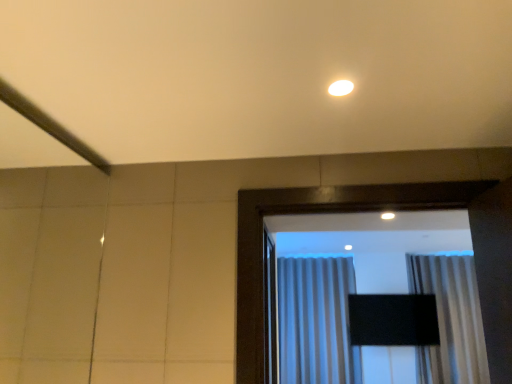
The height and width of the screenshot is (384, 512). What do you see at coordinates (450, 320) in the screenshot?
I see `silky white curtain at center, which is the 2th curtain in left-to-right order` at bounding box center [450, 320].

The image size is (512, 384). I want to click on silky white curtain at center, the 1th curtain from the right, so click(x=450, y=320).

Identify the location of silky white curtain at center, the 1th curtain from the right. This screenshot has height=384, width=512. (450, 320).

Who is bigger, gray textured curtain at center, placed as the second curtain when sorted from right to left, or silky white curtain at center, the 1th curtain from the right?

gray textured curtain at center, placed as the second curtain when sorted from right to left.

Is gray textured curtain at center, placed as the second curtain when sorted from right to left, facing away from silky white curtain at center, the 1th curtain from the right?

No, gray textured curtain at center, placed as the second curtain when sorted from right to left, is not facing the opposite direction of silky white curtain at center, the 1th curtain from the right.

Is gray textured curtain at center, placed as the second curtain when sorted from right to left, situated inside silky white curtain at center, the 1th curtain from the right, or outside?

gray textured curtain at center, placed as the second curtain when sorted from right to left, is located beyond the bounds of silky white curtain at center, the 1th curtain from the right.

Can you confirm if gray textured curtain at center, placed as the second curtain when sorted from right to left, is shorter than silky white curtain at center, which is the 2th curtain in left-to-right order?

Incorrect, the height of gray textured curtain at center, placed as the second curtain when sorted from right to left, does not fall short of that of silky white curtain at center, which is the 2th curtain in left-to-right order.

Where is `curtain in front of the gray textured curtain at center, placed as the second curtain when sorted from right to left`? curtain in front of the gray textured curtain at center, placed as the second curtain when sorted from right to left is located at coordinates (450, 320).

Could you tell me if silky white curtain at center, the 1th curtain from the right, is facing gray textured curtain at center, the first curtain from the left?

No, silky white curtain at center, the 1th curtain from the right, does not turn towards gray textured curtain at center, the first curtain from the left.

From the picture: From a real-world perspective, does silky white curtain at center, which is the 2th curtain in left-to-right order, sit lower than gray textured curtain at center, placed as the second curtain when sorted from right to left?

No, from a real-world perspective, silky white curtain at center, which is the 2th curtain in left-to-right order, is not beneath gray textured curtain at center, placed as the second curtain when sorted from right to left.

Which of these two, silky white curtain at center, the 1th curtain from the right, or gray textured curtain at center, placed as the second curtain when sorted from right to left, is smaller?

With smaller size is silky white curtain at center, the 1th curtain from the right.

Is point (344, 82) in front of point (473, 342)?

Yes, it is in front of point (473, 342).

Which object is more forward, white glossy light fixture at upper center or silky white curtain at center, the 1th curtain from the right?

white glossy light fixture at upper center is more forward.

Does white glossy light fixture at upper center turn towards silky white curtain at center, the 1th curtain from the right?

No, white glossy light fixture at upper center is not turned towards silky white curtain at center, the 1th curtain from the right.

Considering the sizes of objects white glossy light fixture at upper center and silky white curtain at center, the 1th curtain from the right, in the image provided, who is taller, white glossy light fixture at upper center or silky white curtain at center, the 1th curtain from the right,?

Standing taller between the two is silky white curtain at center, the 1th curtain from the right.

Is white glossy light fixture at upper center not close to gray textured curtain at center, the first curtain from the left?

Yes.

Is white glossy light fixture at upper center at the left side of gray textured curtain at center, the first curtain from the left?

Indeed, white glossy light fixture at upper center is positioned on the left side of gray textured curtain at center, the first curtain from the left.

Which object is closer to the camera, white glossy light fixture at upper center or gray textured curtain at center, placed as the second curtain when sorted from right to left?

white glossy light fixture at upper center is in front.

Between white glossy light fixture at upper center and gray textured curtain at center, placed as the second curtain when sorted from right to left, which one has smaller size?

white glossy light fixture at upper center.

Between silky white curtain at center, which is the 2th curtain in left-to-right order, and white glossy light fixture at upper center, which one has smaller size?

Smaller between the two is white glossy light fixture at upper center.

Looking at their sizes, would you say silky white curtain at center, which is the 2th curtain in left-to-right order, is wider or thinner than white glossy light fixture at upper center?

Considering their sizes, silky white curtain at center, which is the 2th curtain in left-to-right order, looks broader than white glossy light fixture at upper center.

Between silky white curtain at center, which is the 2th curtain in left-to-right order, and white glossy light fixture at upper center, which one is positioned in front?

white glossy light fixture at upper center is in front.

In terms of width, does gray textured curtain at center, placed as the second curtain when sorted from right to left, look wider or thinner when compared to white glossy light fixture at upper center?

gray textured curtain at center, placed as the second curtain when sorted from right to left, is wider than white glossy light fixture at upper center.

Is gray textured curtain at center, the first curtain from the left, in front of or behind white glossy light fixture at upper center in the image?

In the image, gray textured curtain at center, the first curtain from the left, appears behind white glossy light fixture at upper center.

Considering the sizes of objects gray textured curtain at center, placed as the second curtain when sorted from right to left, and white glossy light fixture at upper center in the image provided, who is shorter, gray textured curtain at center, placed as the second curtain when sorted from right to left, or white glossy light fixture at upper center?

With less height is white glossy light fixture at upper center.

At what (x,y) coordinates should I click in order to perform the action: click on curtain that appears below the silky white curtain at center, the 1th curtain from the right (from the image's perspective). Please return your answer as a coordinate pair (x, y). The height and width of the screenshot is (384, 512). Looking at the image, I should click on (316, 321).

The width and height of the screenshot is (512, 384). I want to click on curtain located on the left of silky white curtain at center, which is the 2th curtain in left-to-right order, so click(316, 321).

Estimate the real-world distances between objects in this image. Which object is further from white glossy light fixture at upper center, silky white curtain at center, which is the 2th curtain in left-to-right order, or gray textured curtain at center, the first curtain from the left?

gray textured curtain at center, the first curtain from the left.

Looking at the image, which one is located further to white glossy light fixture at upper center, gray textured curtain at center, placed as the second curtain when sorted from right to left, or silky white curtain at center, the 1th curtain from the right?

Among the two, gray textured curtain at center, placed as the second curtain when sorted from right to left, is located further to white glossy light fixture at upper center.

Considering their positions, is gray textured curtain at center, placed as the second curtain when sorted from right to left, positioned further to silky white curtain at center, the 1th curtain from the right, than white glossy light fixture at upper center?

white glossy light fixture at upper center lies further to silky white curtain at center, the 1th curtain from the right, than the other object.

From the image, which object appears to be nearer to gray textured curtain at center, the first curtain from the left, white glossy light fixture at upper center or silky white curtain at center, the 1th curtain from the right?

silky white curtain at center, the 1th curtain from the right, lies closer to gray textured curtain at center, the first curtain from the left, than the other object.

When comparing their distances from gray textured curtain at center, placed as the second curtain when sorted from right to left, does silky white curtain at center, the 1th curtain from the right, or white glossy light fixture at upper center seem closer?

silky white curtain at center, the 1th curtain from the right, lies closer to gray textured curtain at center, placed as the second curtain when sorted from right to left, than the other object.

Based on the photo, when comparing their distances from silky white curtain at center, which is the 2th curtain in left-to-right order, does white glossy light fixture at upper center or gray textured curtain at center, the first curtain from the left, seem closer?

gray textured curtain at center, the first curtain from the left, is positioned closer to the anchor silky white curtain at center, which is the 2th curtain in left-to-right order.

This screenshot has width=512, height=384. What are the coordinates of `curtain between white glossy light fixture at upper center and gray textured curtain at center, the first curtain from the left, from front to back` in the screenshot? It's located at pyautogui.click(x=450, y=320).